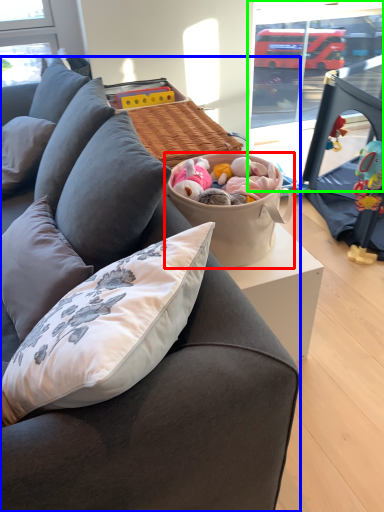
Question: Which is nearer to the picnic basket (highlighted by a red box)? studio couch (highlighted by a blue box) or window screen (highlighted by a green box).

Choices:
 (A) studio couch
 (B) window screen

Answer: (A)